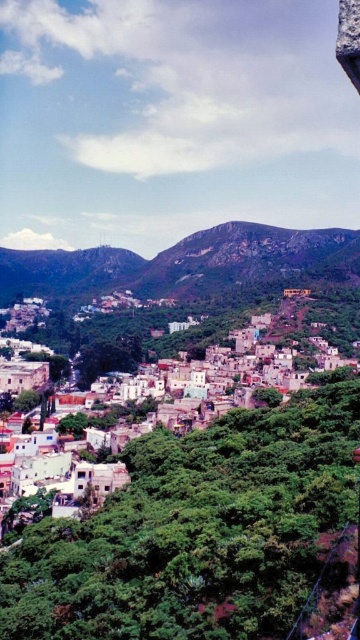
Question: Observing the image, what is the correct spatial positioning of green rocky mountain at center in reference to white matte buildings at lower left?

Choices:
 (A) above
 (B) below

Answer: (A)

Question: Can you confirm if green rocky mountain at center is bigger than white matte buildings at lower left?

Choices:
 (A) no
 (B) yes

Answer: (B)

Question: Which of the following is the closest to the observer?

Choices:
 (A) green rocky mountain at center
 (B) white matte buildings at lower left

Answer: (B)

Question: Which point is closer to the camera taking this photo?

Choices:
 (A) (259, 237)
 (B) (232, 413)

Answer: (B)

Question: Does green rocky mountain at center appear on the right side of white matte buildings at lower left?

Choices:
 (A) yes
 (B) no

Answer: (B)